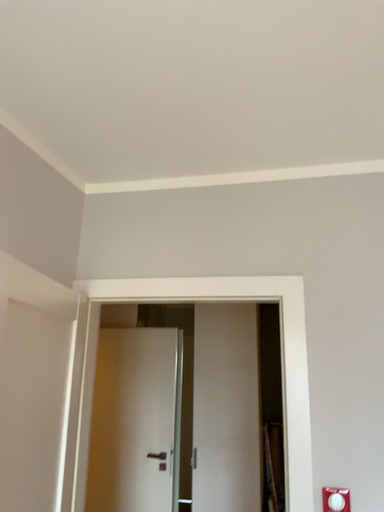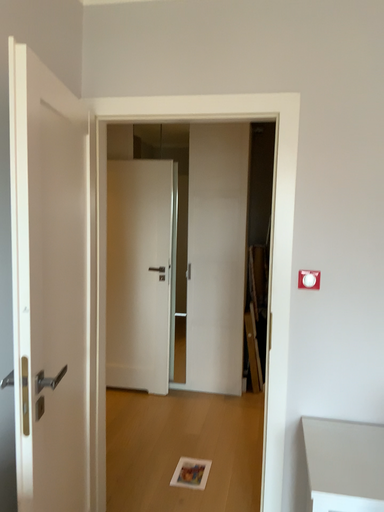
Question: How did the camera likely rotate when shooting the video?

Choices:
 (A) rotated downward
 (B) rotated upward

Answer: (A)